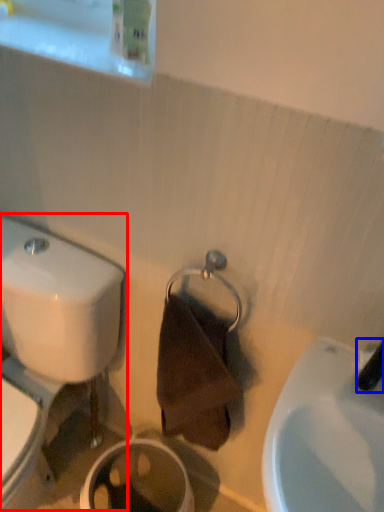
Question: Which of the following is the closest to the observer, toilet (highlighted by a red box) or plumbing fixture (highlighted by a blue box)?

Choices:
 (A) toilet
 (B) plumbing fixture

Answer: (B)